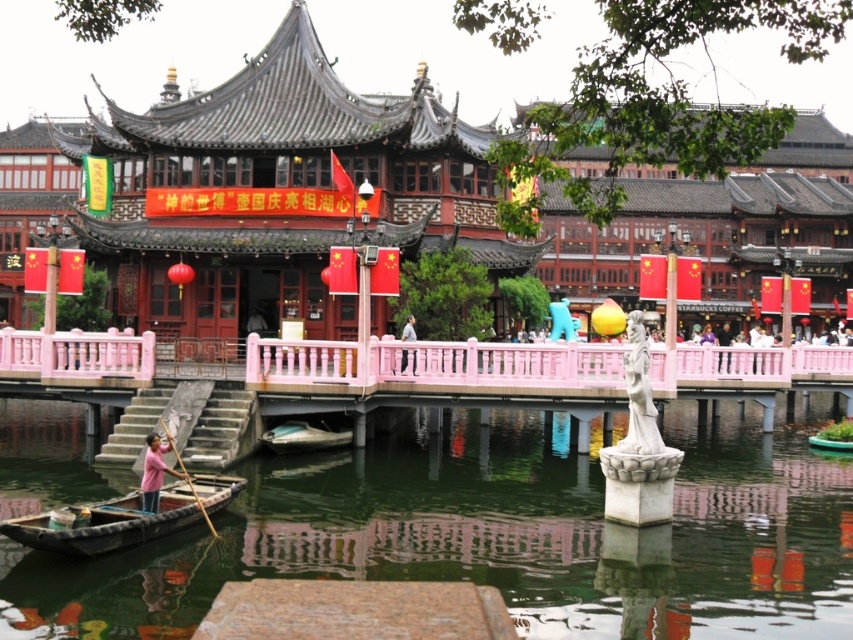
Is point (286, 433) farther from viewer compared to point (202, 508)?

Yes, it is behind point (202, 508).

Does wooden boat at center have a smaller size compared to wooden at left?

Correct, wooden boat at center occupies less space than wooden at left.

Is point (351, 429) positioned behind point (177, 454)?

That is True.

The width and height of the screenshot is (853, 640). I want to click on wooden boat at center, so point(303,436).

Does wooden canoe at lower left appear over wooden boat at center?

No, wooden canoe at lower left is not above wooden boat at center.

Is wooden canoe at lower left wider than wooden boat at center?

Correct, the width of wooden canoe at lower left exceeds that of wooden boat at center.

Which is behind, point (242, 486) or point (282, 436)?

The point (282, 436) is more distant.

The image size is (853, 640). I want to click on wooden canoe at lower left, so click(x=106, y=524).

Which is in front, point (48, 547) or point (166, 433)?

Point (48, 547) is more forward.

Is wooden canoe at lower left below pink fabric person at lower left?

Yes, wooden canoe at lower left is below pink fabric person at lower left.

Describe the element at coordinates (106, 524) in the screenshot. The height and width of the screenshot is (640, 853). I see `wooden canoe at lower left` at that location.

Locate an element on the screen. wooden canoe at lower left is located at coordinates (106, 524).